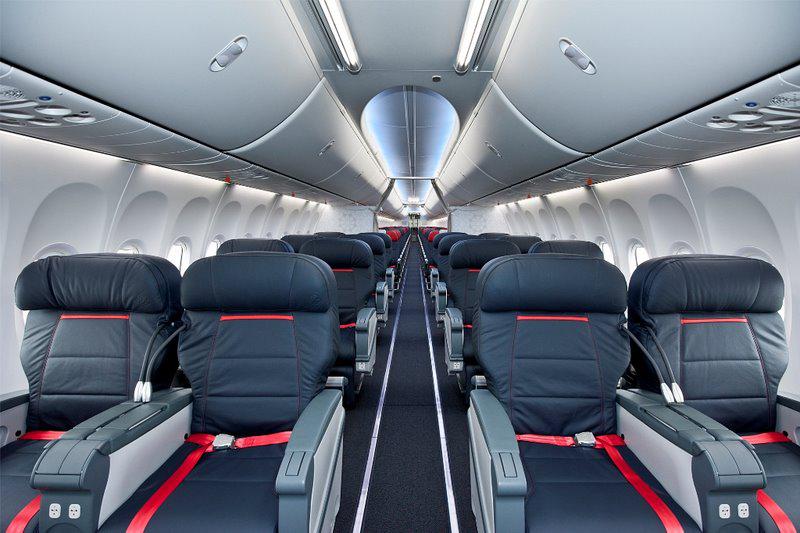
Locate an element on the screen. window seats is located at coordinates (102, 274), (238, 236), (294, 238), (326, 233), (493, 231), (522, 240), (545, 245), (686, 281).